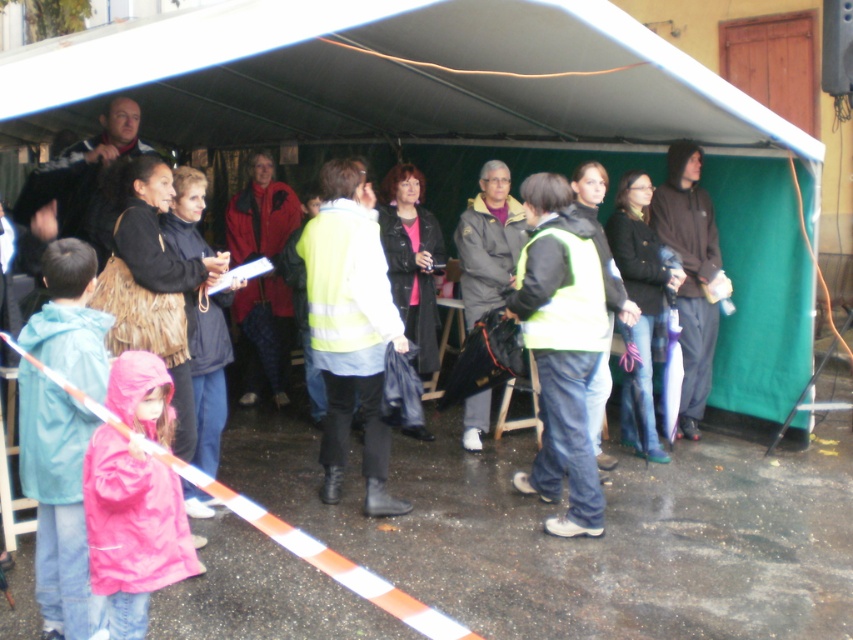
Question: Which point appears closest to the camera in this image?

Choices:
 (A) (347, 72)
 (B) (381, 332)

Answer: (B)

Question: Among these objects, which one is nearest to the camera?

Choices:
 (A) yellow reflective vest at center
 (B) dark brown hoodie at right

Answer: (A)

Question: Is pink matte raincoat at lower left in front of dark brown hoodie at right?

Choices:
 (A) no
 (B) yes

Answer: (B)

Question: Is white fabric tent at center thinner than matte gray jacket at center?

Choices:
 (A) no
 (B) yes

Answer: (A)

Question: Estimate the real-world distances between objects in this image. Which object is closer to the white fabric tent at center?

Choices:
 (A) dark brown leather jacket at center
 (B) matte gray jacket at center

Answer: (B)

Question: From the image, what is the correct spatial relationship of white fabric tent at center in relation to yellow reflective vest at center?

Choices:
 (A) left
 (B) right

Answer: (A)